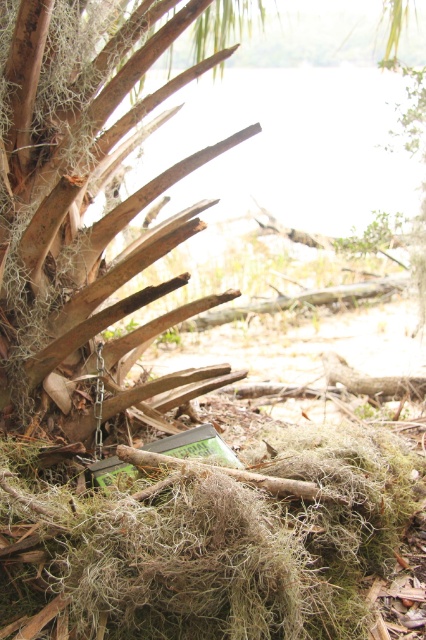
Between green plastic canister at lower center and transparent water at upper center, which one appears on the left side from the viewer's perspective?

Positioned to the left is green plastic canister at lower center.

Measure the distance between point (138,554) and camera.

A distance of 1.11 meters exists between point (138,554) and camera.

The height and width of the screenshot is (640, 426). What do you see at coordinates (210, 545) in the screenshot?
I see `green plastic canister at lower center` at bounding box center [210, 545].

Find the location of a particular element. This screenshot has height=640, width=426. green plastic canister at lower center is located at coordinates (210, 545).

Does brown rough palm tree at center appear on the right side of transparent water at upper center?

In fact, brown rough palm tree at center is to the left of transparent water at upper center.

In the scene shown: Which of these two, brown rough palm tree at center or transparent water at upper center, stands shorter?

brown rough palm tree at center is shorter.

Who is more distant from viewer, (66, 150) or (250, 193)?

Positioned behind is point (250, 193).

The width and height of the screenshot is (426, 640). Identify the location of brown rough palm tree at center. (77, 180).

Is green plastic canister at lower center to the left of brown rough palm tree at center from the viewer's perspective?

In fact, green plastic canister at lower center is to the right of brown rough palm tree at center.

Does green plastic canister at lower center have a larger size compared to brown rough palm tree at center?

Incorrect, green plastic canister at lower center is not larger than brown rough palm tree at center.

The height and width of the screenshot is (640, 426). Identify the location of green plastic canister at lower center. (210, 545).